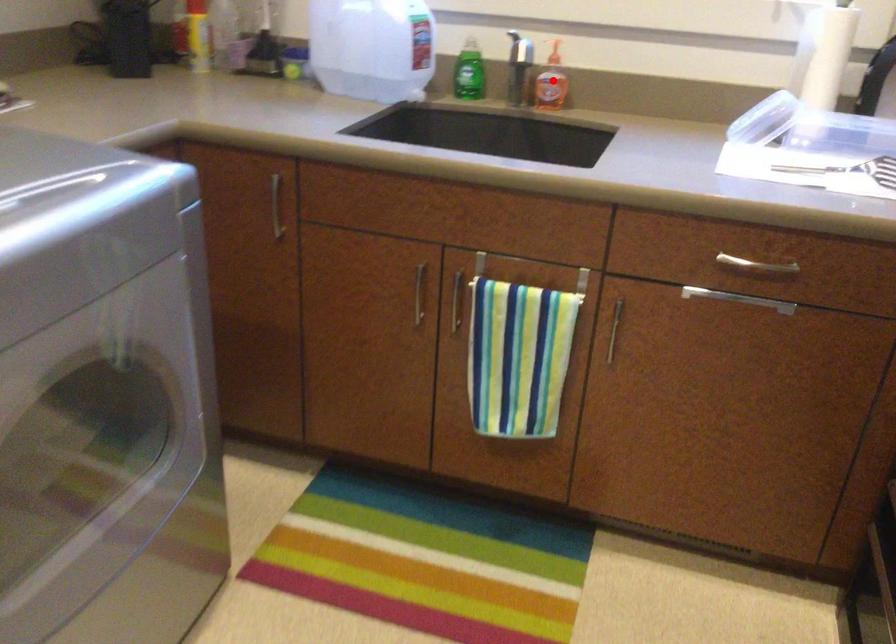
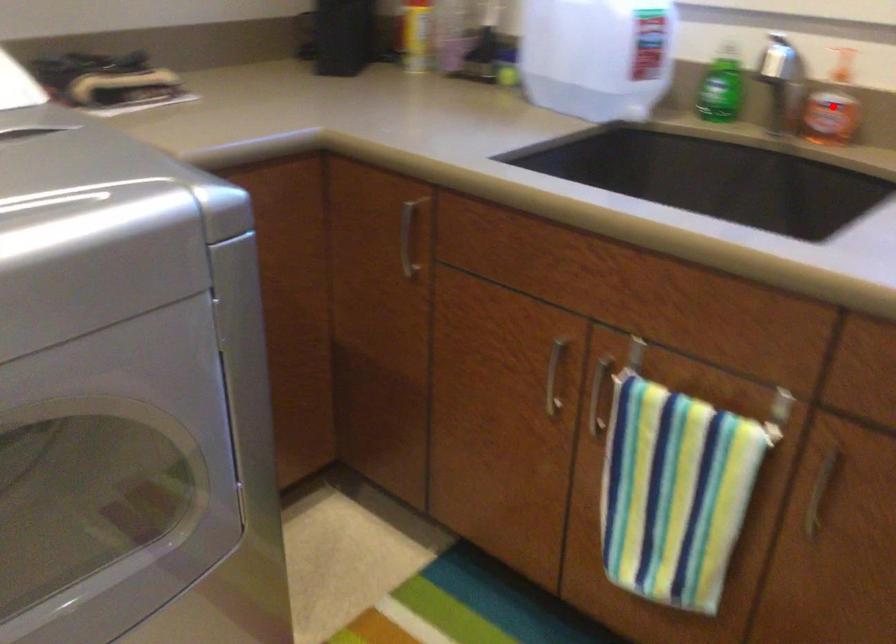
I am providing you with two images of the same scene from different viewpoints. A red point is marked on the first image and another point is marked on the second image. Is the red point in image1 aligned with the point shown in image2?

Yes